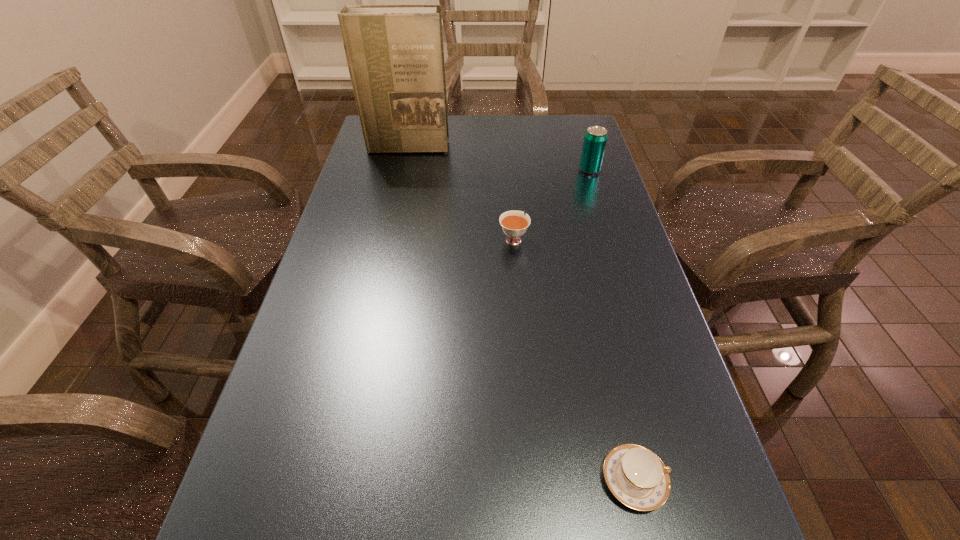
This screenshot has width=960, height=540. I want to click on blank space located on the side of the farther teacup with the handle, so click(x=511, y=208).

At what (x,y) coordinates should I click in order to perform the action: click on vacant space positioned 0.390m on the side of the farther teacup with the handle. Please return your answer as a coordinate pair (x, y). This screenshot has width=960, height=540. Looking at the image, I should click on (506, 148).

Locate an element on the screen. This screenshot has width=960, height=540. free space located 0.260m on the side of the farther teacup with the handle is located at coordinates (508, 171).

At what (x,y) coordinates should I click in order to perform the action: click on object positioned at the far edge. Please return your answer as a coordinate pair (x, y). Looking at the image, I should click on (395, 55).

At what (x,y) coordinates should I click in order to perform the action: click on object present at the left edge. Please return your answer as a coordinate pair (x, y). This screenshot has width=960, height=540. Looking at the image, I should click on (395, 55).

You are a GUI agent. You are given a task and a screenshot of the screen. Output one action in this format:
    pyautogui.click(x=<x>, y=<y>)
    Task: Click on the beer can that is at the right edge
    Image resolution: width=960 pixels, height=540 pixels.
    Given the screenshot: What is the action you would take?
    pyautogui.click(x=595, y=139)

You are a GUI agent. You are given a task and a screenshot of the screen. Output one action in this format:
    pyautogui.click(x=<x>, y=<y>)
    Task: Click on the teacup positioned at the right edge
    The height and width of the screenshot is (540, 960).
    Given the screenshot: What is the action you would take?
    pyautogui.click(x=637, y=477)

The image size is (960, 540). In order to click on object that is at the far left corner in this screenshot , I will do `click(395, 55)`.

You are a GUI agent. You are given a task and a screenshot of the screen. Output one action in this format:
    pyautogui.click(x=<x>, y=<y>)
    Task: Click on the free point at the far edge
    This screenshot has width=960, height=540.
    Given the screenshot: What is the action you would take?
    pyautogui.click(x=512, y=132)

This screenshot has height=540, width=960. In the image, there is a desktop. What are the coordinates of `blank space at the left edge` in the screenshot? It's located at (374, 241).